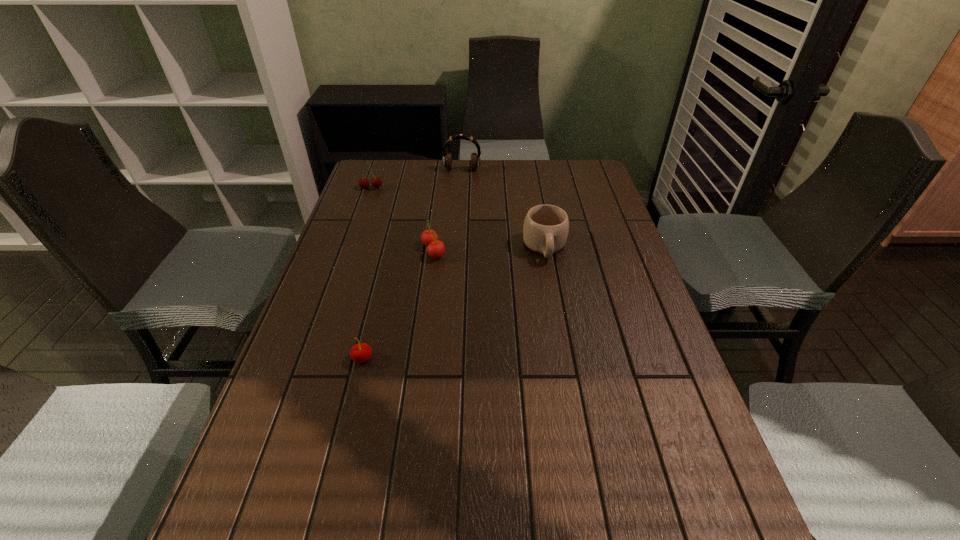
Identify the location of the farthest object. The width and height of the screenshot is (960, 540). (447, 157).

Locate an element on the screen. This screenshot has height=540, width=960. headset is located at coordinates (447, 157).

The width and height of the screenshot is (960, 540). Find the location of `the leftmost cherry`. the leftmost cherry is located at coordinates (376, 182).

This screenshot has width=960, height=540. I want to click on the tallest cherry, so pyautogui.click(x=376, y=182).

You are a GUI agent. You are given a task and a screenshot of the screen. Output one action in this format:
    pyautogui.click(x=<x>, y=<y>)
    Task: Click on the rightmost object
    This screenshot has height=540, width=960.
    Given the screenshot: What is the action you would take?
    pyautogui.click(x=546, y=227)

I want to click on the second farthest cherry, so click(x=435, y=248).

At what (x,y) coordinates should I click in order to perform the action: click on the nearest object. Please return your answer as a coordinate pair (x, y). The image size is (960, 540). Looking at the image, I should click on (361, 352).

The image size is (960, 540). I want to click on the nearest cherry, so click(361, 352).

At what (x,y) coordinates should I click in order to perform the action: click on vacant region located on the ear cup of the headset. Please return your answer as a coordinate pair (x, y). Looking at the image, I should click on (461, 187).

Where is `vacant space located on the surface of the tallest cherry`? The width and height of the screenshot is (960, 540). vacant space located on the surface of the tallest cherry is located at coordinates (351, 243).